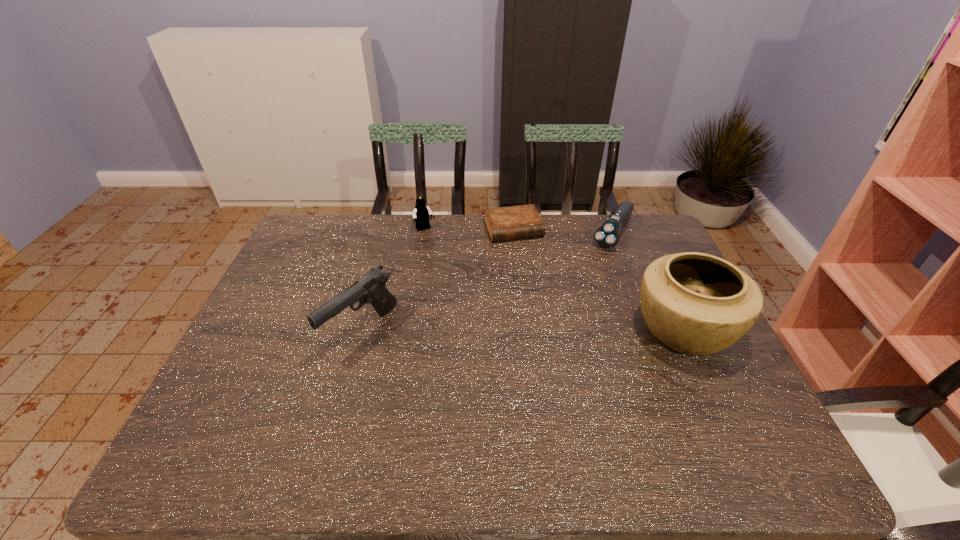
This screenshot has width=960, height=540. Find the location of `free space on the desktop that is between the second tallest object and the pottery and is positioned on the head of the fourth tallest object`. free space on the desktop that is between the second tallest object and the pottery and is positioned on the head of the fourth tallest object is located at coordinates coord(544,329).

At what (x,y) coordinates should I click in order to perform the action: click on vacant space on the desktop that is between the fourth shortest object and the pottery and is positioned on the spine side of the shortest object. Please return your answer as a coordinate pair (x, y). The width and height of the screenshot is (960, 540). Looking at the image, I should click on (558, 329).

Where is `free space on the desktop that is between the fourth shortest object and the pottery and is positioned on the front-facing side of the fourth object from right to left`? free space on the desktop that is between the fourth shortest object and the pottery and is positioned on the front-facing side of the fourth object from right to left is located at coordinates (486, 329).